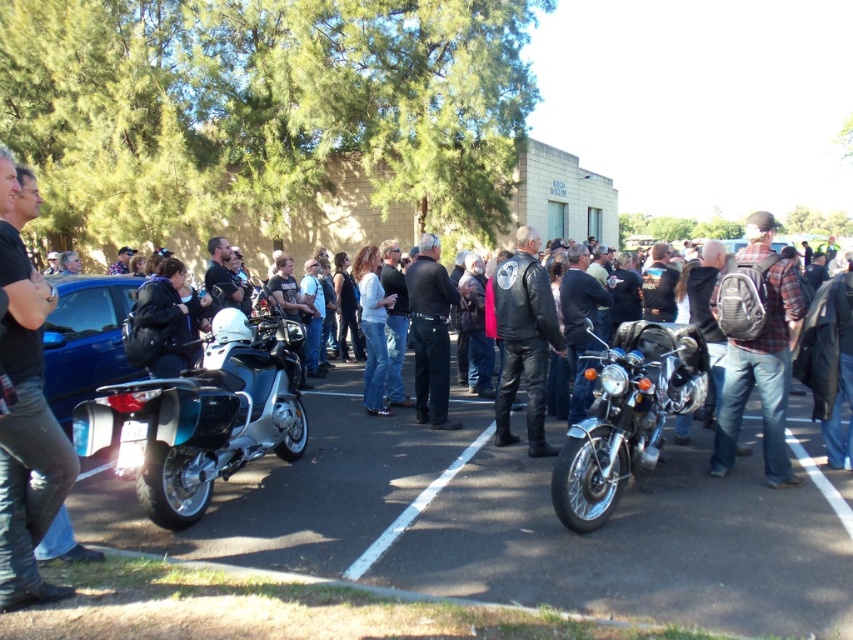
Question: Among these objects, which one is farthest from the camera?

Choices:
 (A) shiny chrome motorcycle at center
 (B) leather jacket at center
 (C) blue matte car at left
 (D) plaid fabric shirt at center-right

Answer: (B)

Question: Which of these objects is positioned farthest from the leather jacket at center?

Choices:
 (A) shiny chrome motorcycle at center
 (B) black leather jacket at left
 (C) white painted line at center
 (D) shiny metallic motorcycle at left

Answer: (B)

Question: Considering the relative positions of shiny metallic motorcycle at left and blue matte car at left in the image provided, where is shiny metallic motorcycle at left located with respect to blue matte car at left?

Choices:
 (A) right
 (B) left

Answer: (A)

Question: Does leather jacket at center appear over black leather jacket at center?

Choices:
 (A) no
 (B) yes

Answer: (A)

Question: Which object is positioned closest to the black leather jacket at center?

Choices:
 (A) shiny metallic motorcycle at left
 (B) blue matte car at left
 (C) white painted line at center
 (D) plaid fabric shirt at center-right

Answer: (C)

Question: Considering the relative positions of black leather jacket at left and leather jacket at center in the image provided, where is black leather jacket at left located with respect to leather jacket at center?

Choices:
 (A) above
 (B) below

Answer: (B)